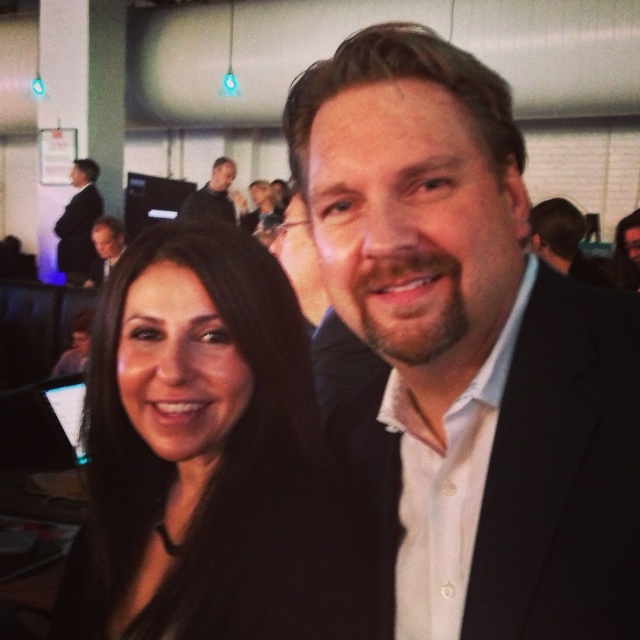
Question: Which of the following is the farthest from the observer?

Choices:
 (A) (211, 180)
 (B) (282, 326)
 (C) (376, 134)
 (D) (88, 276)

Answer: (A)

Question: Is black fabric at left in front of matte black suit at upper left?

Choices:
 (A) no
 (B) yes

Answer: (B)

Question: Does dark gray suit at upper center appear under matte black suit at center?

Choices:
 (A) yes
 (B) no

Answer: (B)

Question: Can you confirm if black fabric at left is wider than dark suit at left?

Choices:
 (A) yes
 (B) no

Answer: (A)

Question: Which object is the farthest from the black suit at center?

Choices:
 (A) matte black suit at center
 (B) black fabric at left
 (C) matte black suit at upper left
 (D) dark gray suit at upper center

Answer: (D)

Question: Which object appears closest to the camera in this image?

Choices:
 (A) dark suit at left
 (B) matte black suit at upper left
 (C) matte black suit at center
 (D) black fabric at left

Answer: (D)